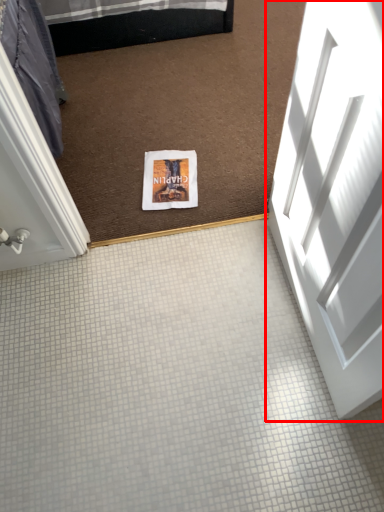
Question: In this image, where is door (annotated by the red box) located relative to flyer?

Choices:
 (A) left
 (B) right

Answer: (B)